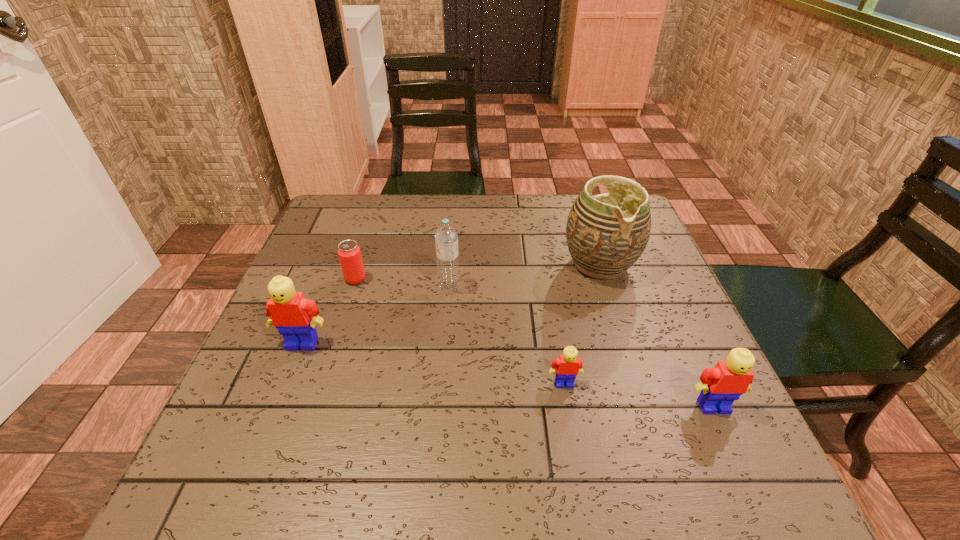
Where is `vacant area that lies between the water bottle and the beer can`? The height and width of the screenshot is (540, 960). vacant area that lies between the water bottle and the beer can is located at coordinates (402, 283).

Find the location of a particular element. The height and width of the screenshot is (540, 960). free spot between the nearest Lego and the fourth object from left to right is located at coordinates (639, 395).

The height and width of the screenshot is (540, 960). What are the coordinates of `free spot between the third object from right to left and the beer can` in the screenshot? It's located at (460, 331).

You are a GUI agent. You are given a task and a screenshot of the screen. Output one action in this format:
    pyautogui.click(x=<x>, y=<y>)
    Task: Click on the free point between the second Lego from left to right and the pottery
    
    Given the screenshot: What is the action you would take?
    pyautogui.click(x=582, y=323)

Image resolution: width=960 pixels, height=540 pixels. I want to click on free space between the pottery and the nearest Lego, so click(x=657, y=335).

The image size is (960, 540). In order to click on vacant area that lies between the pottery and the second nearest Lego in this screenshot , I will do `click(582, 323)`.

This screenshot has height=540, width=960. Find the location of `free area in between the beer can and the shortest Lego`. free area in between the beer can and the shortest Lego is located at coordinates (460, 331).

Where is `object identified as the fifth closest to the water bottle`? The height and width of the screenshot is (540, 960). object identified as the fifth closest to the water bottle is located at coordinates (722, 385).

Select which object appears as the fifth closest to the third object from right to left. Please provide its 2D coordinates. Your answer should be formatted as a tuple, i.e. [(x, y)], where the tuple contains the x and y coordinates of a point satisfying the conditions above.

[(349, 253)]

Identify which Lego is the nearest to the third object from right to left. Please provide its 2D coordinates. Your answer should be formatted as a tuple, i.e. [(x, y)], where the tuple contains the x and y coordinates of a point satisfying the conditions above.

[(722, 385)]